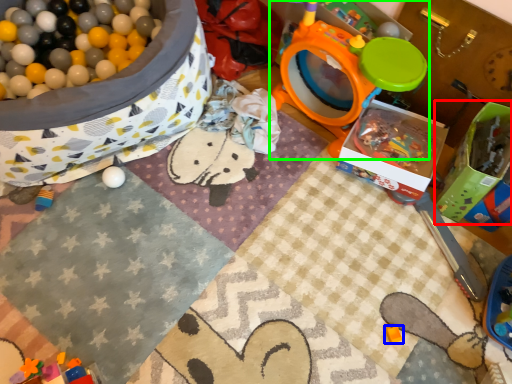
Question: Which object is the closest to the box (highlighted by a red box)? Choose among these: toy (highlighted by a blue box) or toy (highlighted by a green box).

Choices:
 (A) toy
 (B) toy

Answer: (B)